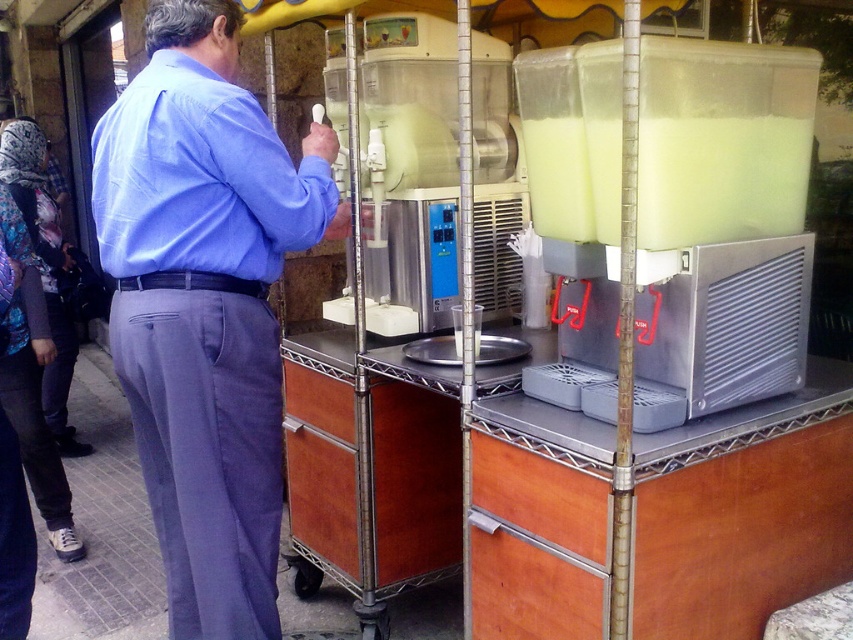
Question: Estimate the real-world distances between objects in this image. Which object is closer to the translucent plastic blender at right?

Choices:
 (A) blue cotton shirt at upper left
 (B) translucent plastic container at right

Answer: (B)

Question: In this image, where is blue cotton shirt at upper left located relative to translucent plastic container at right?

Choices:
 (A) right
 (B) left

Answer: (B)

Question: Is translucent plastic blender at right thinner than translucent plastic blender at center?

Choices:
 (A) no
 (B) yes

Answer: (A)

Question: Which of these objects is positioned farthest from the blue cotton shirt at upper left?

Choices:
 (A) translucent plastic container at right
 (B) translucent plastic blender at center
 (C) translucent plastic blender at right

Answer: (A)

Question: Among these points, which one is farthest from the camera?

Choices:
 (A) (401, 266)
 (B) (146, 154)

Answer: (A)

Question: Does translucent plastic blender at right have a lesser width compared to translucent plastic container at right?

Choices:
 (A) yes
 (B) no

Answer: (B)